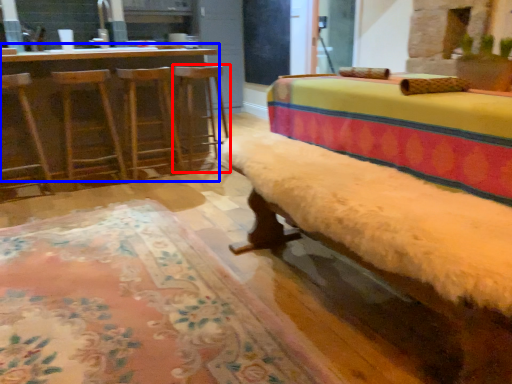
Question: Which object is further to the camera taking this photo, bar stool (highlighted by a red box) or table (highlighted by a blue box)?

Choices:
 (A) bar stool
 (B) table

Answer: (A)